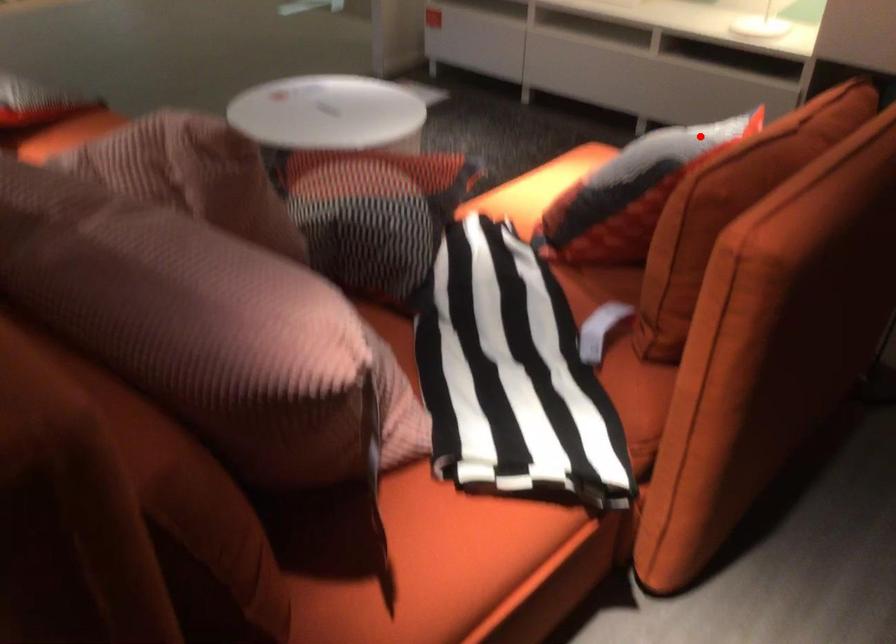
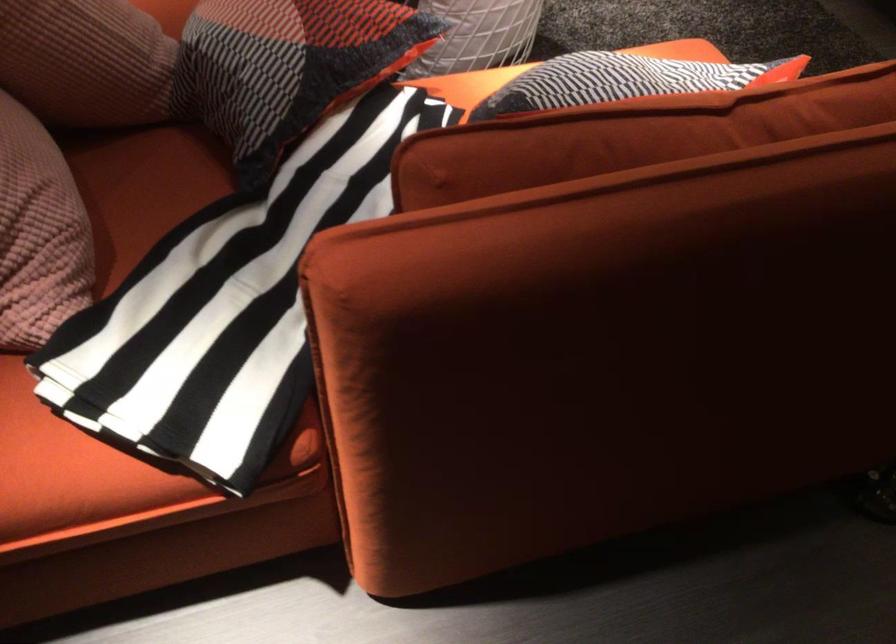
Find the pixel in the second image that matches the highlighted location in the first image.

(623, 80)